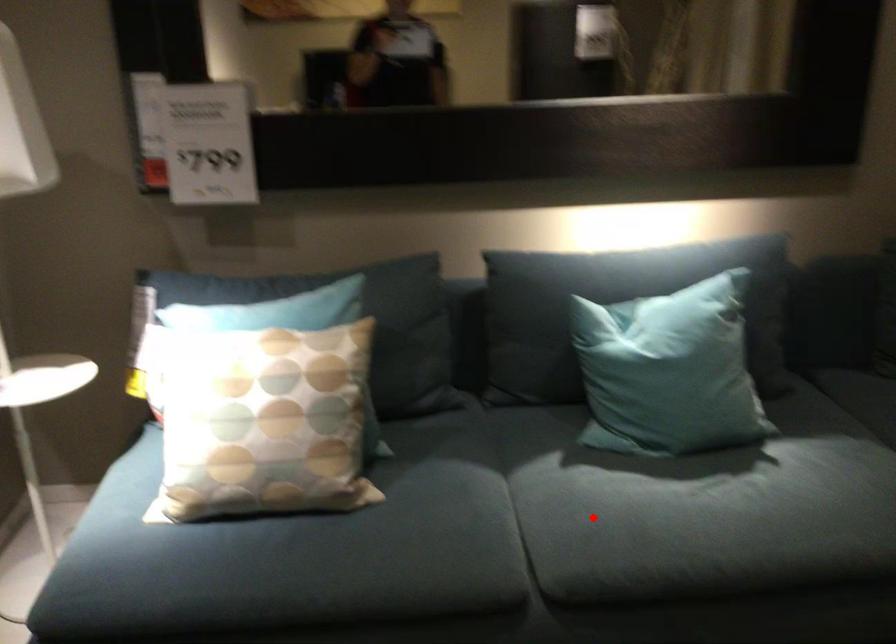
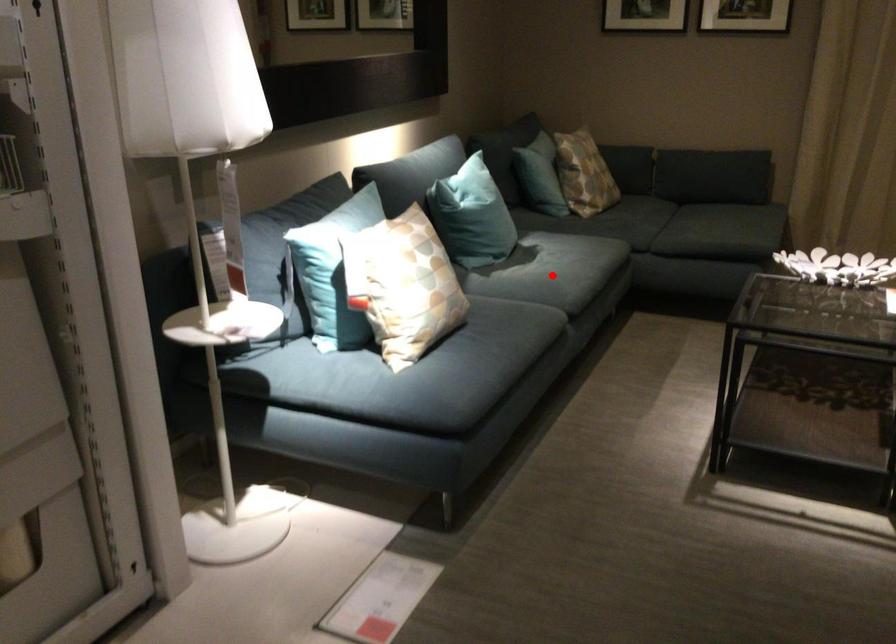
I am providing you with two images of the same scene from different viewpoints. A red point is marked on the first image and another point is marked on the second image. Is the red point in image1 aligned with the point shown in image2?

Yes